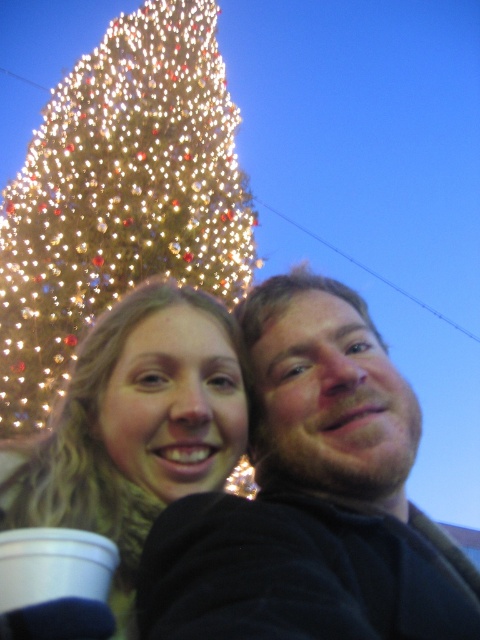
Is point (181, 240) positioned behind point (192, 394)?

Yes, it is behind point (192, 394).

Describe the element at coordinates (120, 196) in the screenshot. I see `illuminated glass christmas tree at upper left` at that location.

Is point (23, 248) positioned after point (132, 570)?

Yes, it is behind point (132, 570).

The width and height of the screenshot is (480, 640). I want to click on illuminated glass christmas tree at upper left, so pos(120,196).

Is point (410, 620) closer to viewer compared to point (168, 6)?

Yes, point (410, 620) is in front of point (168, 6).

Does dark brown hair at center appear over illuminated glass christmas tree at upper left?

Actually, dark brown hair at center is below illuminated glass christmas tree at upper left.

Which is in front, point (264, 410) or point (97, 204)?

Point (264, 410)

The height and width of the screenshot is (640, 480). In order to click on dark brown hair at center in this screenshot , I will do `click(310, 509)`.

Between dark brown hair at center and white paper cup at lower left, which one is positioned higher?

Positioned higher is white paper cup at lower left.

Which is in front, point (319, 436) or point (7, 545)?

Point (7, 545) is in front.

The height and width of the screenshot is (640, 480). What do you see at coordinates (310, 509) in the screenshot?
I see `dark brown hair at center` at bounding box center [310, 509].

I want to click on dark brown hair at center, so click(x=310, y=509).